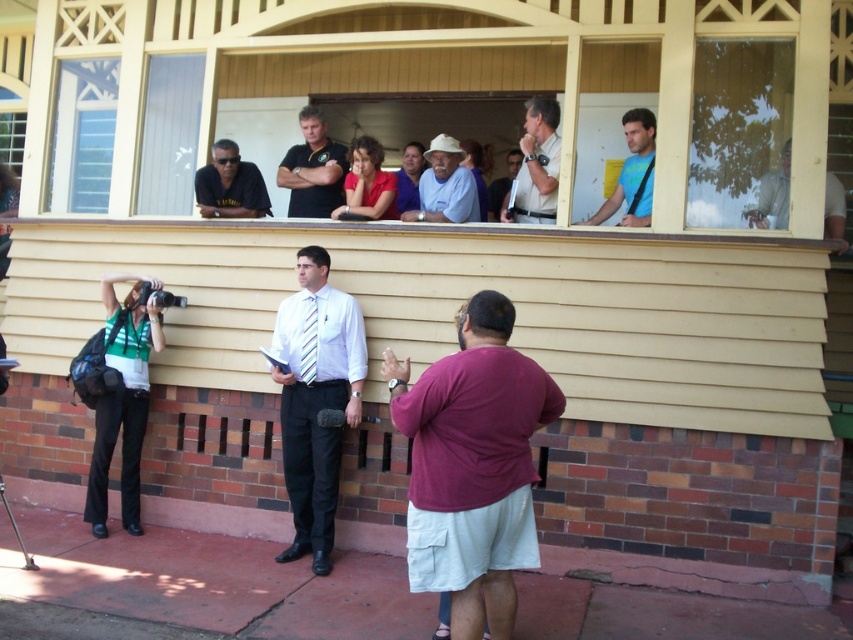
Is matte black polo shirt at center taller than light brown wood at upper right?

Yes, matte black polo shirt at center is taller than light brown wood at upper right.

Who is positioned more to the left, matte black polo shirt at center or light brown wood at upper right?

matte black polo shirt at center

Is point (344, 173) closer to camera compared to point (827, 196)?

No.

In order to click on matte black polo shirt at center in this screenshot , I will do (x=312, y=168).

Between point (392, 376) and point (375, 202), which one is positioned in front?

Point (392, 376) is more forward.

This screenshot has height=640, width=853. Find the location of `maroon shirt at center`. maroon shirt at center is located at coordinates (473, 465).

The height and width of the screenshot is (640, 853). I want to click on maroon shirt at center, so [473, 465].

Can you confirm if light brown leather jacket at upper center is smaller than light blue shirt at center?

Yes, light brown leather jacket at upper center is smaller than light blue shirt at center.

Can you confirm if light brown leather jacket at upper center is positioned to the left of light blue shirt at center?

In fact, light brown leather jacket at upper center is to the right of light blue shirt at center.

You are a GUI agent. You are given a task and a screenshot of the screen. Output one action in this format:
    pyautogui.click(x=<x>, y=<y>)
    Task: Click on the light brown leather jacket at upper center
    The width and height of the screenshot is (853, 640).
    Given the screenshot: What is the action you would take?
    pyautogui.click(x=537, y=164)